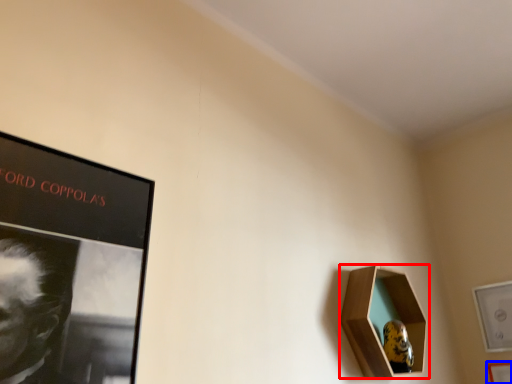
Question: Which object is further to the camera taking this photo, picture frame (highlighted by a red box) or picture frame (highlighted by a blue box)?

Choices:
 (A) picture frame
 (B) picture frame

Answer: (B)